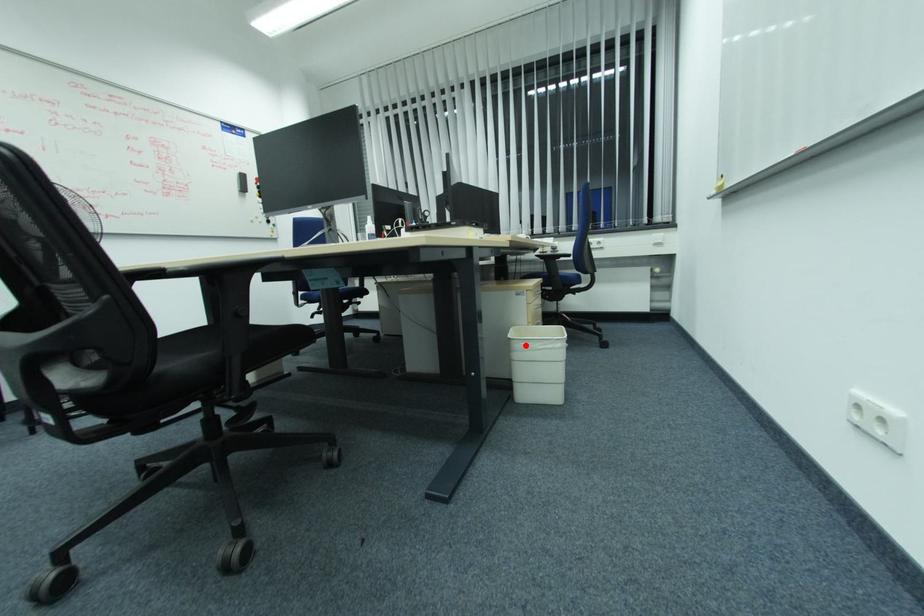
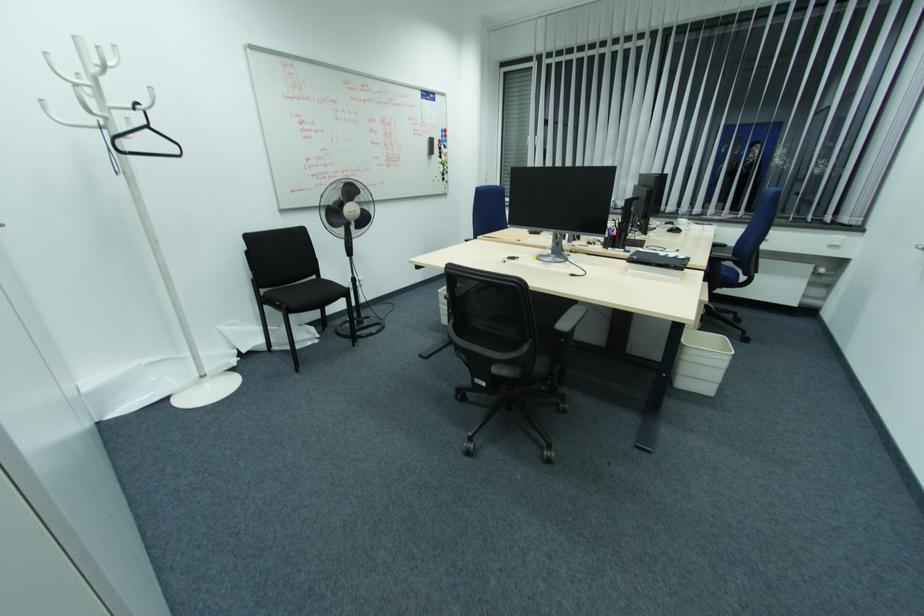
Question: I am providing you with two images of the same scene from different viewpoints. Given a red point in image1, look at the same physical point in image2. Is it:

Choices:
 (A) Closer to the viewpoint
 (B) Farther from the viewpoint

Answer: (A)